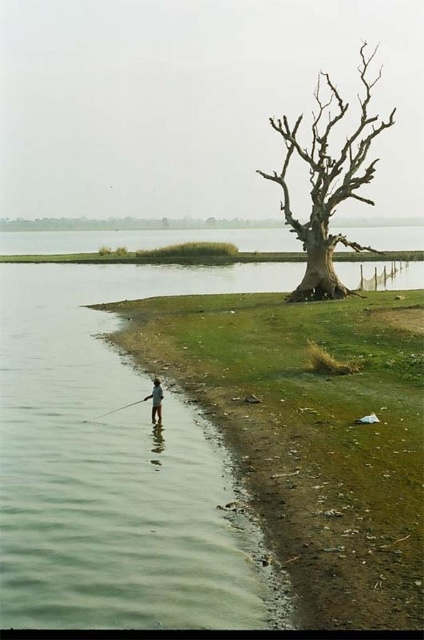
Question: Among these points, which one is farthest from the camera?

Choices:
 (A) 334,296
 (B) 134,310

Answer: (A)

Question: Is bare wood tree at center below smooth white fishing pole at lower left?

Choices:
 (A) no
 (B) yes

Answer: (A)

Question: Can you confirm if green grassy shoreline at lower left is positioned to the left of bare wood tree at center?

Choices:
 (A) yes
 (B) no

Answer: (A)

Question: Considering the relative positions of bare wood tree at center and smooth white fishing pole at lower left in the image provided, where is bare wood tree at center located with respect to smooth white fishing pole at lower left?

Choices:
 (A) below
 (B) above

Answer: (B)

Question: Which object appears farthest from the camera in this image?

Choices:
 (A) bare wood tree at center
 (B) light brown wooden pole at lower left
 (C) smooth white fishing pole at lower left
 (D) green grassy shoreline at lower left

Answer: (A)

Question: Among these objects, which one is farthest from the camera?

Choices:
 (A) bare wood tree at center
 (B) smooth white fishing pole at lower left

Answer: (A)